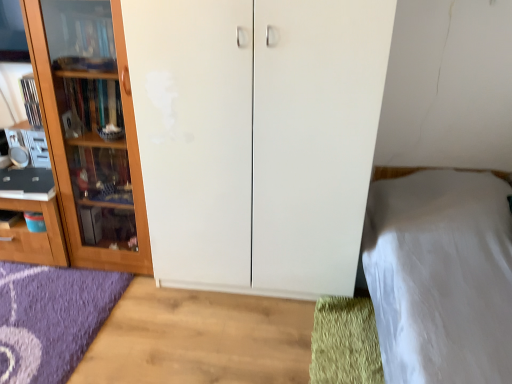
Question: In terms of width, does wooden cabinet at left, the second cupboard when ordered from right to left, look wider or thinner when compared to white matte cupboard at center, the second cupboard positioned from the left?

Choices:
 (A) thin
 (B) wide

Answer: (A)

Question: Is point (124, 125) positioned closer to the camera than point (329, 39)?

Choices:
 (A) closer
 (B) farther

Answer: (B)

Question: Estimate the real-world distances between objects in this image. Which object is farther from the wooden cabinet at left, the second cupboard when ordered from right to left?

Choices:
 (A) white smooth bed at right
 (B) green shaggy doormat at lower right
 (C) white matte cupboard at center, the second cupboard positioned from the left

Answer: (A)

Question: Which object is the closest to the white smooth bed at right?

Choices:
 (A) white matte cupboard at center, acting as the 1th cupboard starting from the right
 (B) green shaggy doormat at lower right
 (C) wooden cabinet at left, the second cupboard when ordered from right to left

Answer: (B)